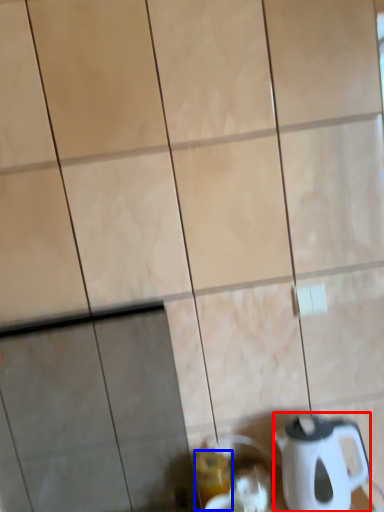
Question: Which object is further to the camera taking this photo, kettle (highlighted by a red box) or beverage (highlighted by a blue box)?

Choices:
 (A) kettle
 (B) beverage

Answer: (B)